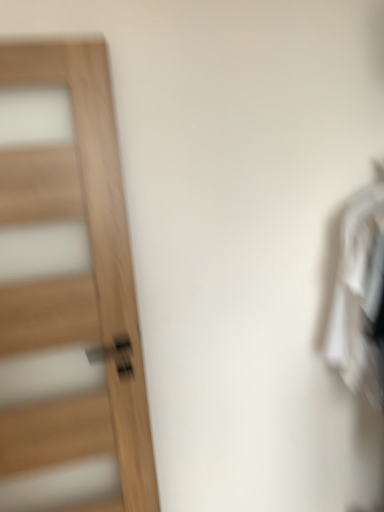
Locate an element on the screen. natural wood door at left is located at coordinates point(76,277).

The width and height of the screenshot is (384, 512). What do you see at coordinates (76, 277) in the screenshot? I see `natural wood door at left` at bounding box center [76, 277].

This screenshot has height=512, width=384. In order to click on natural wood door at left in this screenshot , I will do `click(76, 277)`.